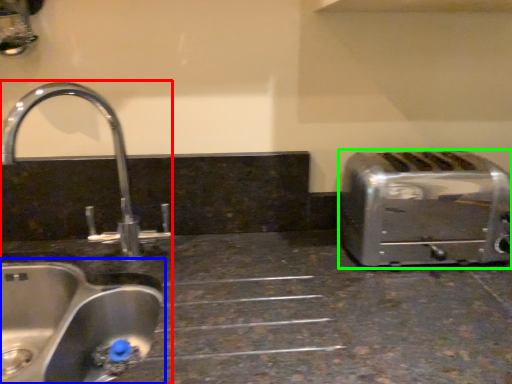
Question: Considering the real-world distances, which object is farthest from sink (highlighted by a red box)? sink (highlighted by a blue box) or toaster (highlighted by a green box)?

Choices:
 (A) sink
 (B) toaster

Answer: (B)